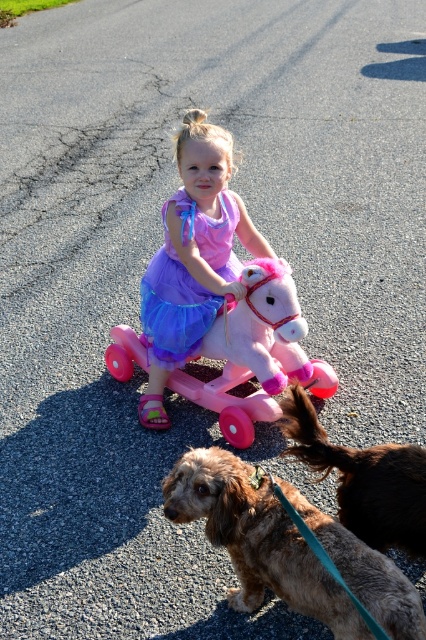
Question: Does pink satin dress at center appear under brown furry dog at lower right?

Choices:
 (A) yes
 (B) no

Answer: (B)

Question: Is pastel pink plastic horse at center below brown furry dog at lower right?

Choices:
 (A) yes
 (B) no

Answer: (B)

Question: Which object is the closest to the purple satin dress at center?

Choices:
 (A) brown fuzzy dog at lower center
 (B) pastel pink plastic horse at center

Answer: (B)

Question: Which point appears closest to the camera in this image?

Choices:
 (A) (290, 600)
 (B) (143, 292)
 (C) (236, 352)

Answer: (A)

Question: Among these objects, which one is farthest from the camera?

Choices:
 (A) pink satin dress at center
 (B) brown furry dog at lower right
 (C) purple satin dress at center

Answer: (C)

Question: Does pastel pink plastic horse at center have a lesser width compared to purple satin dress at center?

Choices:
 (A) yes
 (B) no

Answer: (B)